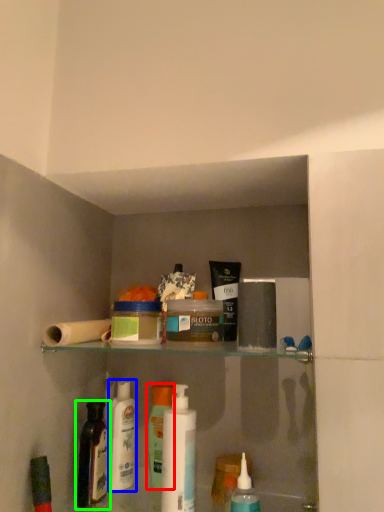
Question: Based on their relative distances, which object is farther from toiletry (highlighted by a red box)? Choose from toiletry (highlighted by a blue box) and bottle (highlighted by a green box).

Choices:
 (A) toiletry
 (B) bottle

Answer: (B)